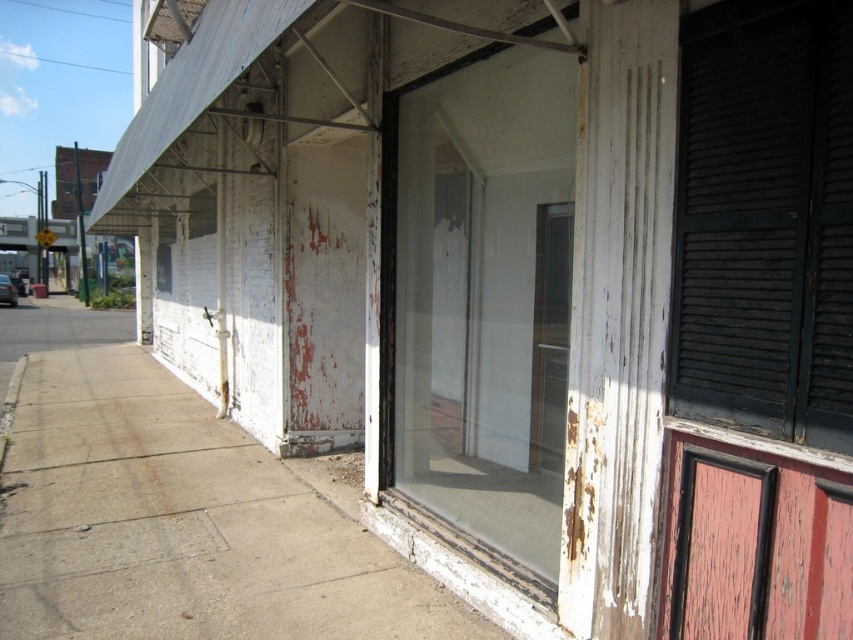
Question: Which object is farther from the camera taking this photo?

Choices:
 (A) dark gray wooden shutter at right
 (B) transparent glass door at center

Answer: (B)

Question: Observing the image, what is the correct spatial positioning of concrete at center in reference to peeling red wood screen door at lower right?

Choices:
 (A) below
 (B) above

Answer: (A)

Question: Which object is the farthest from the transparent glass door at center?

Choices:
 (A) peeling red wood screen door at lower right
 (B) dark gray wooden shutter at right

Answer: (B)

Question: Which point is closer to the camera?

Choices:
 (A) (683, 38)
 (B) (526, 516)
 (C) (186, 429)

Answer: (A)

Question: Does dark gray wooden shutter at right appear on the right side of peeling red wood screen door at lower right?

Choices:
 (A) no
 (B) yes

Answer: (B)

Question: Does concrete at center lie behind peeling red wood screen door at lower right?

Choices:
 (A) yes
 (B) no

Answer: (A)